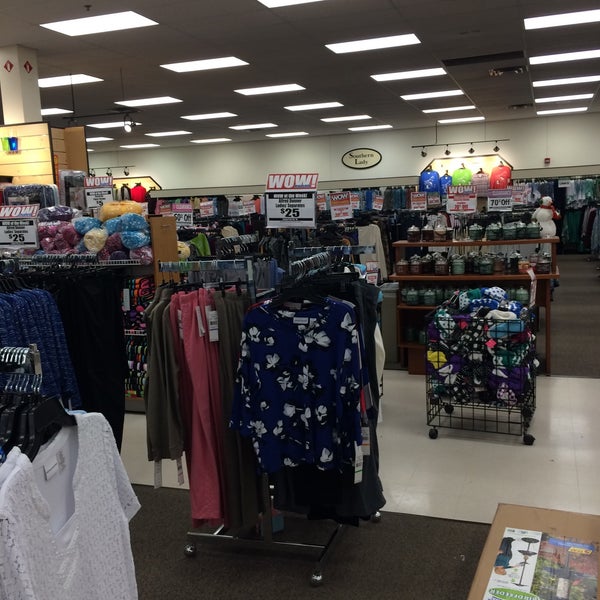
I want to click on floor, so click(x=465, y=463).